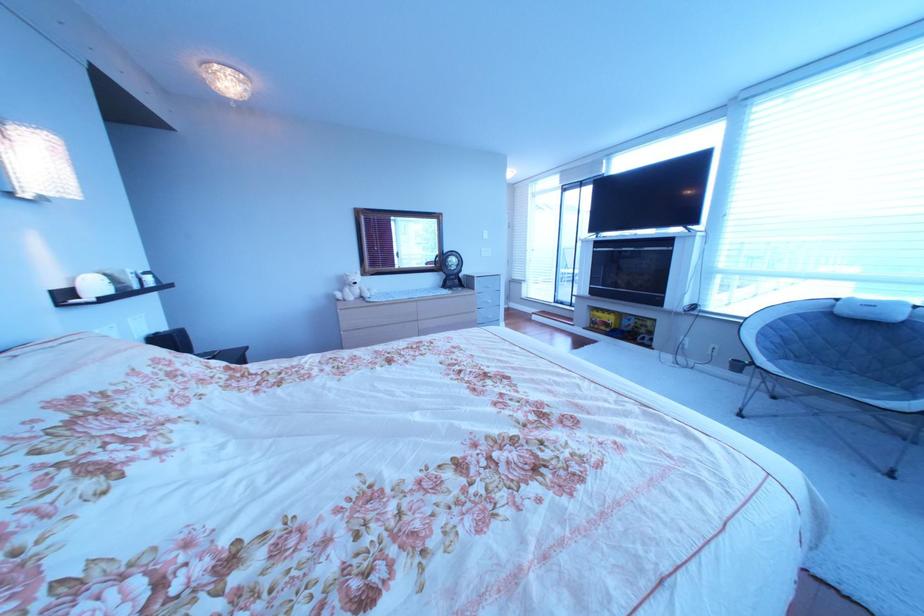
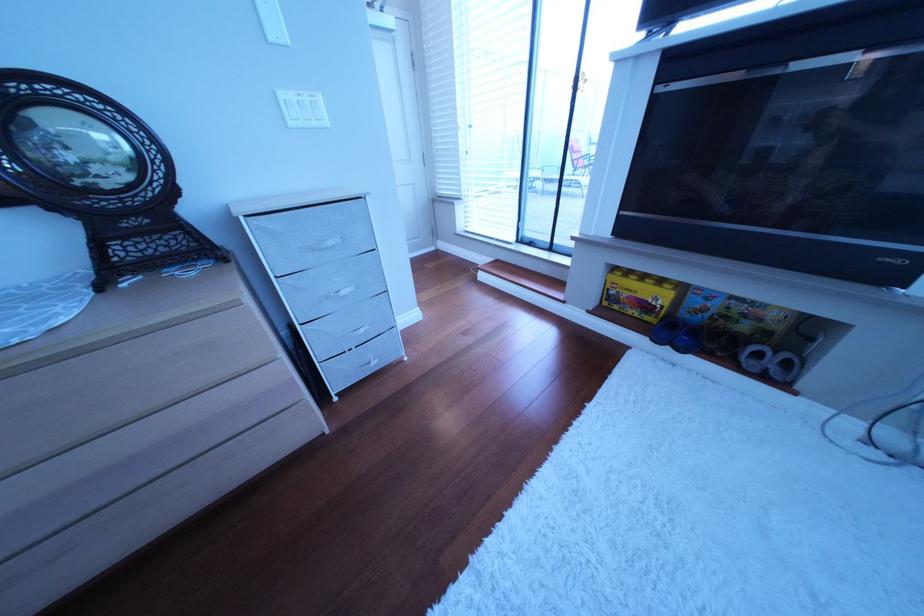
The point at (614, 322) is marked in the first image. Where is the corresponding point in the second image?

(640, 296)